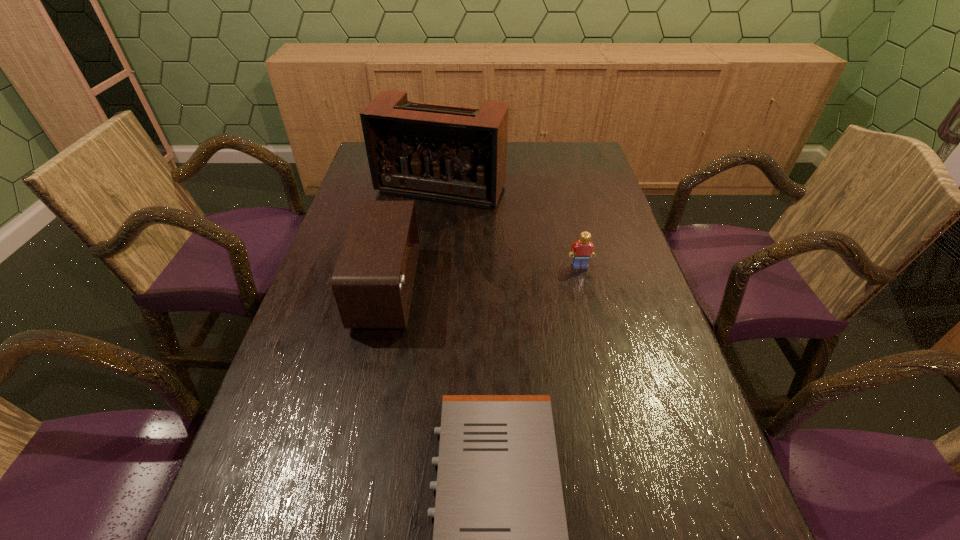
At what (x,y) coordinates should I click in order to perform the action: click on object at the right edge. Please return your answer as a coordinate pair (x, y). Image resolution: width=960 pixels, height=540 pixels. Looking at the image, I should click on (581, 251).

Find the location of a particular element. object located in the far left corner section of the desktop is located at coordinates (452, 154).

The height and width of the screenshot is (540, 960). In order to click on vacant area at the far edge of the desktop in this screenshot , I will do `click(540, 150)`.

The image size is (960, 540). Identify the location of free point at the left edge. (367, 347).

In the image, there is a desktop. At what (x,y) coordinates should I click in order to perform the action: click on vacant space at the right edge. Please return your answer as a coordinate pair (x, y). Looking at the image, I should click on click(x=564, y=205).

This screenshot has height=540, width=960. What are the coordinates of `vacant area that lies between the tallest object and the Lego` in the screenshot? It's located at (511, 227).

Image resolution: width=960 pixels, height=540 pixels. I want to click on vacant space in between the farthest object and the rightmost object, so click(511, 227).

The image size is (960, 540). I want to click on vacant area that lies between the rightmost object and the second nearest radio receiver, so click(484, 277).

At what (x,y) coordinates should I click in order to perform the action: click on vacant space that's between the second shortest object and the second farthest radio receiver. Please return your answer as a coordinate pair (x, y). The image size is (960, 540). Looking at the image, I should click on coord(484,277).

The width and height of the screenshot is (960, 540). Identify the location of empty space that is in between the rightmost object and the tallest radio receiver. (511, 227).